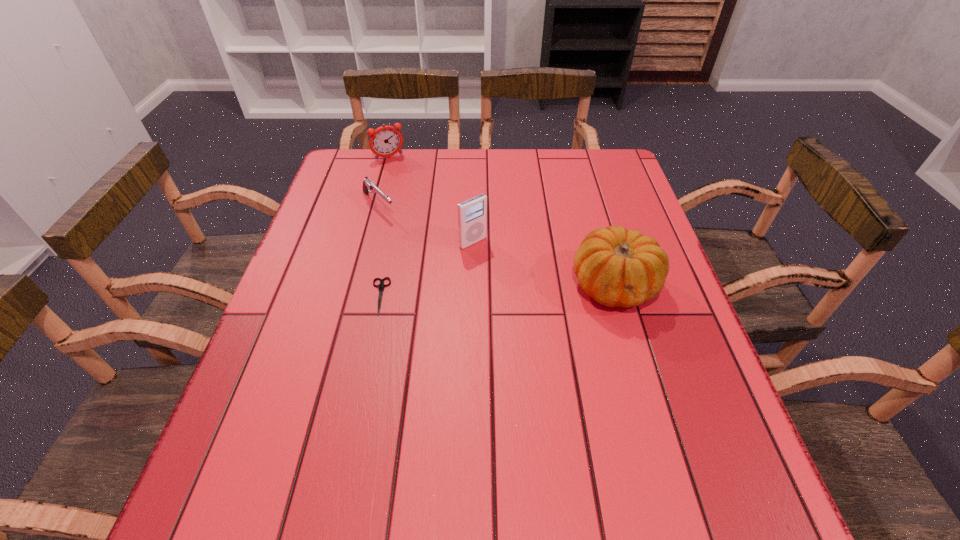
Locate an element on the screen. The image size is (960, 540). blank area at the near left corner is located at coordinates 285,442.

Locate an element on the screen. The width and height of the screenshot is (960, 540). vacant space at the far right corner is located at coordinates (580, 171).

At what (x,y) coordinates should I click in order to perform the action: click on free space at the near right corner of the desktop. Please return your answer as a coordinate pair (x, y). The width and height of the screenshot is (960, 540). Looking at the image, I should click on (699, 410).

You are a GUI agent. You are given a task and a screenshot of the screen. Output one action in this format:
    pyautogui.click(x=<x>, y=<y>)
    Task: Click on the vacant point located between the shears and the rightmost object
    The height and width of the screenshot is (540, 960).
    Given the screenshot: What is the action you would take?
    pyautogui.click(x=497, y=291)

At what (x,y) coordinates should I click in order to perform the action: click on vacant space that's between the pistol and the gourd. Please return your answer as a coordinate pair (x, y). Looking at the image, I should click on (496, 245).

The height and width of the screenshot is (540, 960). What are the coordinates of `free point between the shortest object and the second object from right to left` in the screenshot? It's located at (426, 269).

Locate an element on the screen. free spot between the alarm clock and the third farthest object is located at coordinates (431, 200).

Image resolution: width=960 pixels, height=540 pixels. I want to click on free space between the shortest object and the third nearest object, so click(x=426, y=269).

Image resolution: width=960 pixels, height=540 pixels. I want to click on free space between the shortest object and the alarm clock, so click(x=384, y=227).

This screenshot has height=540, width=960. I want to click on free space between the farthest object and the iPod, so click(431, 200).